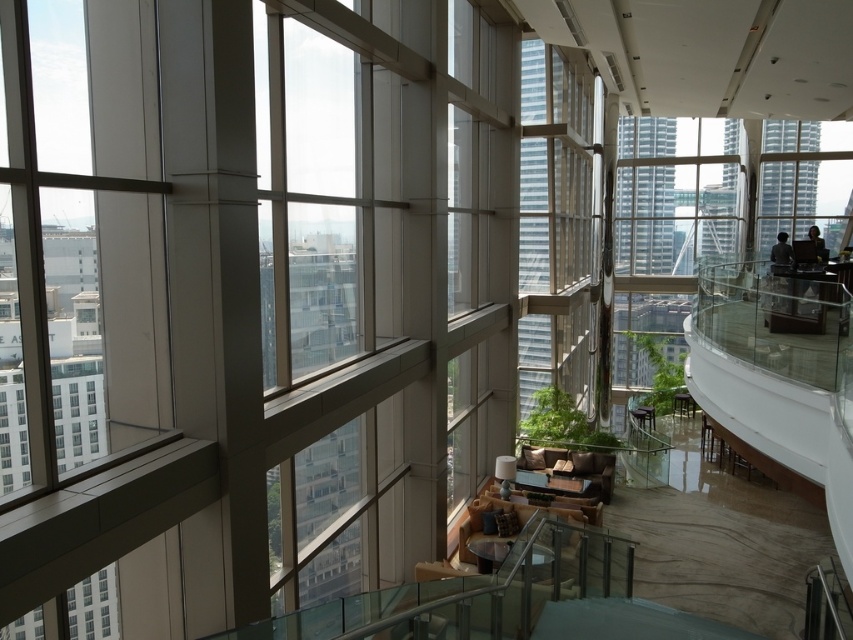
Does transparent glass window at lower left have a greater width compared to dark brown leather jacket at upper right?

No.

Based on the photo, does transparent glass window at lower left appear over dark brown leather jacket at upper right?

Actually, transparent glass window at lower left is below dark brown leather jacket at upper right.

This screenshot has height=640, width=853. What are the coordinates of `transparent glass window at lower left` in the screenshot? It's located at (93, 605).

Does dark hair at upper right come in front of dark brown leather jacket at upper right?

Yes, it is.

The height and width of the screenshot is (640, 853). Describe the element at coordinates (781, 250) in the screenshot. I see `dark hair at upper right` at that location.

This screenshot has width=853, height=640. In order to click on dark hair at upper right in this screenshot , I will do `click(781, 250)`.

Between transparent glass window at lower left and dark hair at upper right, which one is positioned lower?

transparent glass window at lower left

Can you confirm if transparent glass window at lower left is smaller than dark hair at upper right?

Indeed, transparent glass window at lower left has a smaller size compared to dark hair at upper right.

You are a GUI agent. You are given a task and a screenshot of the screen. Output one action in this format:
    pyautogui.click(x=<x>, y=<y>)
    Task: Click on the transparent glass window at lower left
    This screenshot has height=640, width=853.
    Given the screenshot: What is the action you would take?
    pyautogui.click(x=93, y=605)